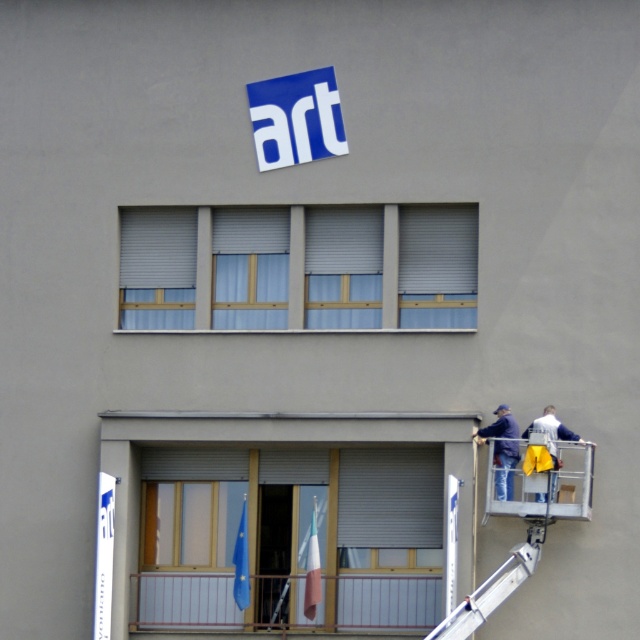
Based on the photo, you are standing in front of the building and see two points marked on the facade. The first point is at coordinates point (192, 266) and the second is at point (580, 508). Which point is closer to the glass balcony railing?

Point (192, 266) is behind point (580, 508), so the second point is closer to the glass balcony railing.

You are an architect reviewing the building facade. You notice two blue fabrics on the building exterior. The first is the blue fabric at upper center, and the second is the blue fabric window at center. Which of these two blue fabrics is shorter in height?

The blue fabric at upper center is not as tall as the blue fabric window at center, so the blue fabric at upper center is shorter in height.